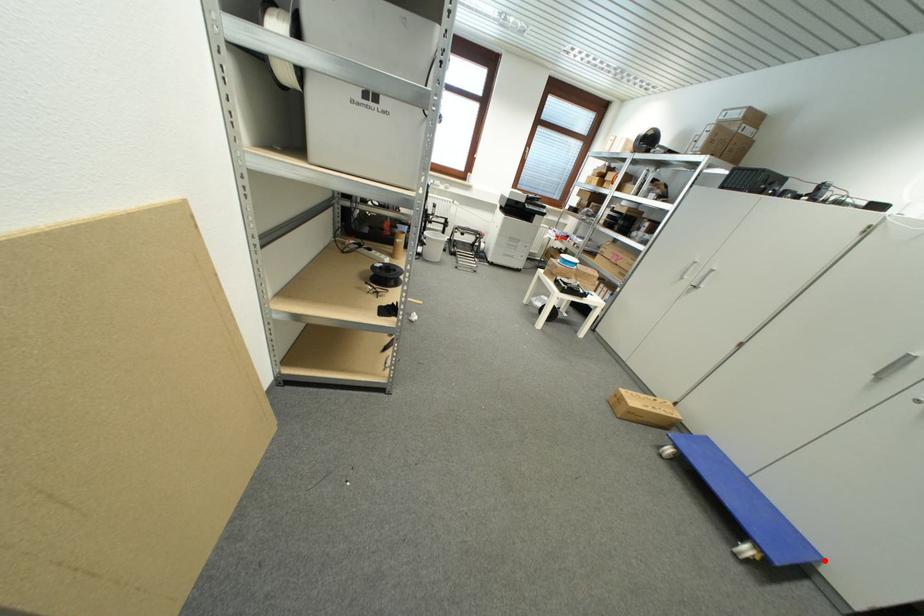
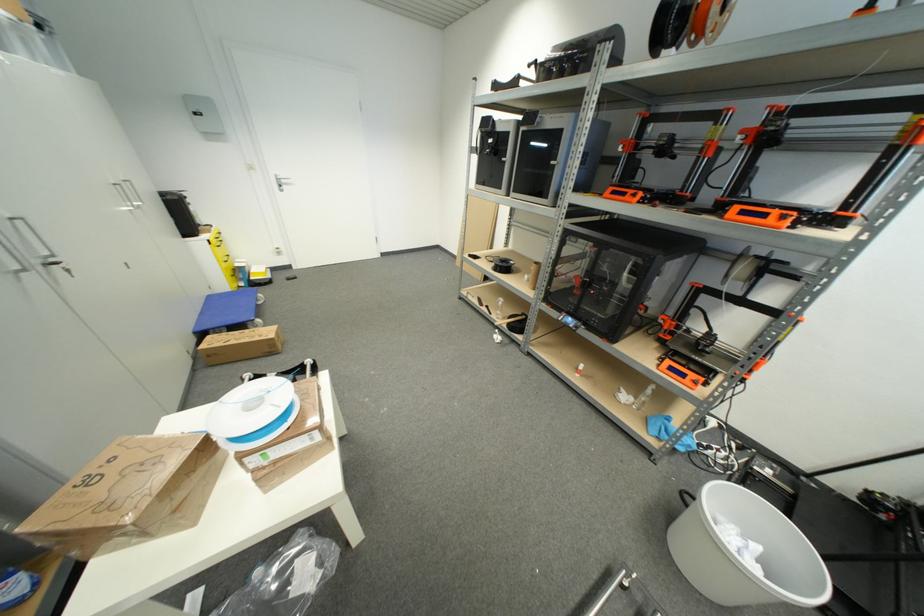
In the second image, find the point that corresponds to the highlighted location in the first image.

(213, 299)